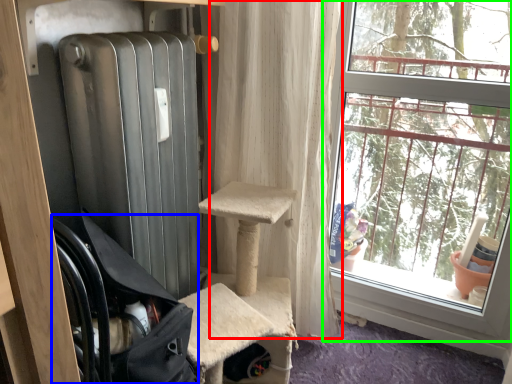
Question: Estimate the real-world distances between objects in this image. Which object is closer to curtain (highlighted by a red box), chair (highlighted by a blue box) or window (highlighted by a green box)?

Choices:
 (A) chair
 (B) window

Answer: (B)